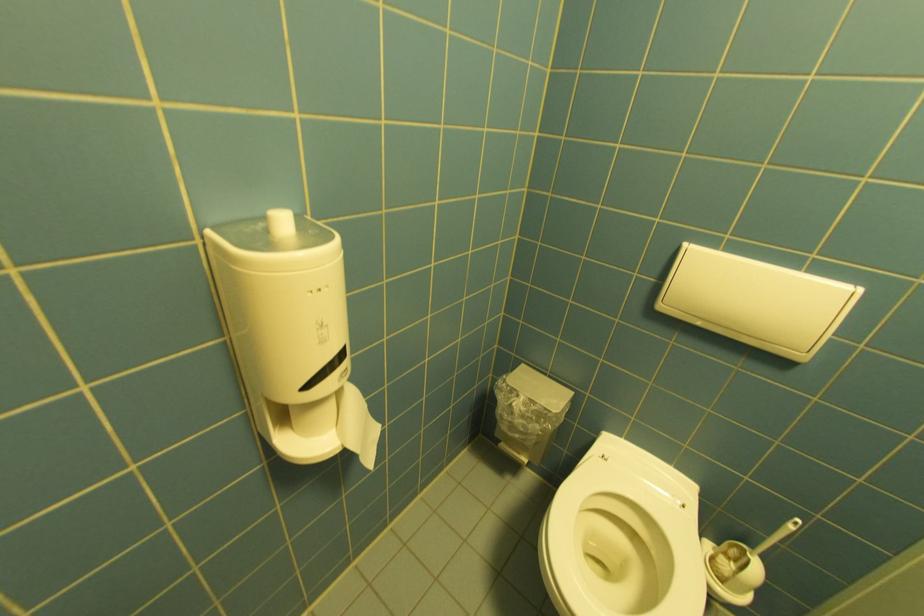
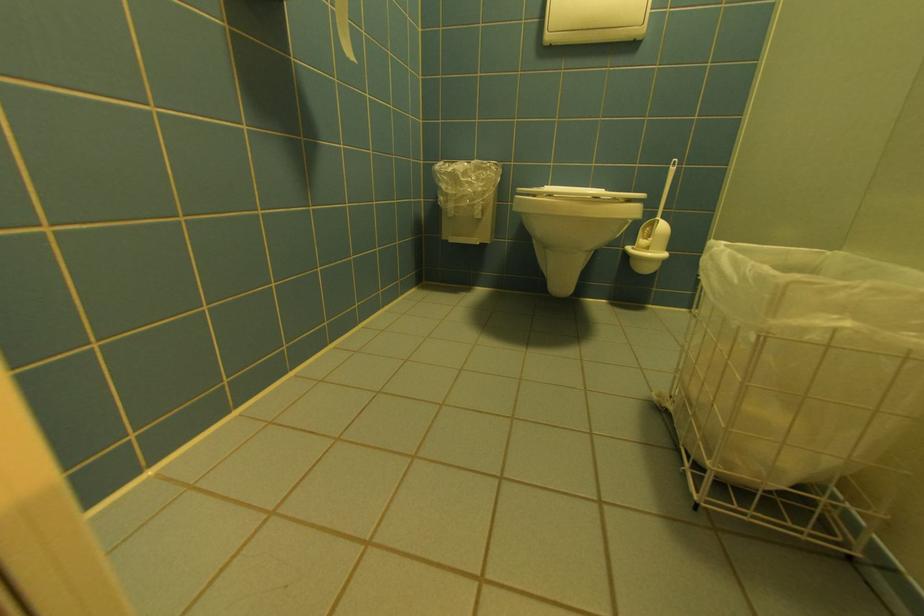
Question: The camera is either moving clockwise (left) or counter-clockwise (right) around the object. The first image is from the beginning of the video and the second image is from the end. Is the camera moving left or right when shooting the video?

Choices:
 (A) Left
 (B) Right

Answer: (A)